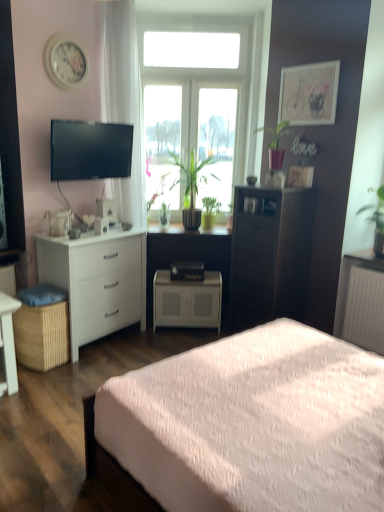
Question: Is white glossy desk at lower left further to the viewer compared to dark wood cabinet at center, the 3th chest of drawers when ordered from left to right?

Choices:
 (A) yes
 (B) no

Answer: (B)

Question: Is white glossy desk at lower left positioned before dark wood cabinet at center, the 1th chest of drawers in the right-to-left sequence?

Choices:
 (A) no
 (B) yes

Answer: (B)

Question: From the image's perspective, would you say white glossy desk at lower left is shown under dark wood cabinet at center, the 3th chest of drawers when ordered from left to right?

Choices:
 (A) no
 (B) yes

Answer: (B)

Question: Does white glossy desk at lower left have a greater width compared to dark wood cabinet at center, the 3th chest of drawers when ordered from left to right?

Choices:
 (A) no
 (B) yes

Answer: (A)

Question: Can you confirm if white glossy desk at lower left is taller than dark wood cabinet at center, the 3th chest of drawers when ordered from left to right?

Choices:
 (A) no
 (B) yes

Answer: (A)

Question: From a real-world perspective, is white glossy desk at lower left beneath dark wood cabinet at center, the 1th chest of drawers in the right-to-left sequence?

Choices:
 (A) no
 (B) yes

Answer: (B)

Question: Can you confirm if green glossy plant at upper right, acting as the 1th houseplant starting from the right, is taller than brown woven picnic basket at lower left?

Choices:
 (A) yes
 (B) no

Answer: (A)

Question: Can you confirm if green glossy plant at upper right, the fifth houseplant viewed from the left, is smaller than brown woven picnic basket at lower left?

Choices:
 (A) yes
 (B) no

Answer: (A)

Question: Is green glossy plant at upper right, the fifth houseplant viewed from the left, outside brown woven picnic basket at lower left?

Choices:
 (A) yes
 (B) no

Answer: (A)

Question: Is green glossy plant at upper right, the fifth houseplant viewed from the left, in front of brown woven picnic basket at lower left?

Choices:
 (A) yes
 (B) no

Answer: (A)

Question: Can you confirm if green glossy plant at upper right, the fifth houseplant viewed from the left, is positioned to the left of brown woven picnic basket at lower left?

Choices:
 (A) yes
 (B) no

Answer: (B)

Question: From a real-world perspective, is green glossy plant at upper right, the fifth houseplant viewed from the left, located beneath brown woven picnic basket at lower left?

Choices:
 (A) no
 (B) yes

Answer: (A)

Question: Is white glossy clock at upper left at the left side of green matte plant at center, the first houseplant in the left-to-right sequence?

Choices:
 (A) no
 (B) yes

Answer: (B)